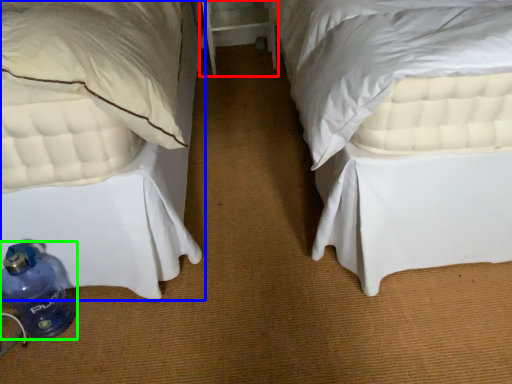
Question: Which object is positioned closest to table (highlighted by a red box)? Select from bed (highlighted by a blue box) and bottle (highlighted by a green box).

Choices:
 (A) bed
 (B) bottle

Answer: (A)